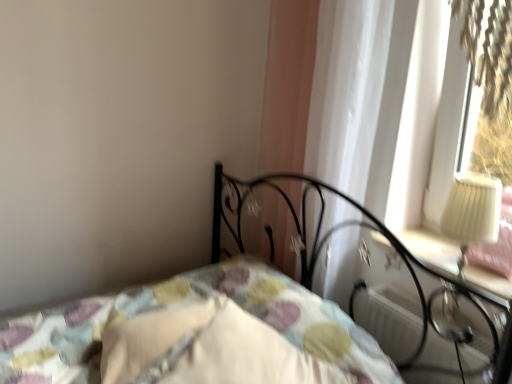
What do you see at coordinates (347, 91) in the screenshot? Image resolution: width=512 pixels, height=384 pixels. I see `white sheer curtain at upper right` at bounding box center [347, 91].

What is the approximate height of white sheer curtain at upper right?

1.04 meters.

I want to click on white soft pillow at center, marked as the 2th pillow in a left-to-right arrangement, so click(x=210, y=348).

Between white soft pillow at center, the first pillow when ordered from right to left, and white plastic radiator at lower right, which one has larger width?

white soft pillow at center, the first pillow when ordered from right to left.

Based on the photo, from their relative heights in the image, would you say white soft pillow at center, marked as the 2th pillow in a left-to-right arrangement, is taller or shorter than white plastic radiator at lower right?

Clearly, white soft pillow at center, marked as the 2th pillow in a left-to-right arrangement, is taller compared to white plastic radiator at lower right.

Is white soft pillow at center, marked as the 2th pillow in a left-to-right arrangement, spatially inside white plastic radiator at lower right, or outside of it?

white soft pillow at center, marked as the 2th pillow in a left-to-right arrangement, cannot be found inside white plastic radiator at lower right.

Between white soft pillow at center, marked as the 2th pillow in a left-to-right arrangement, and white plastic radiator at lower right, which one is positioned in front?

white soft pillow at center, marked as the 2th pillow in a left-to-right arrangement, is in front.

What's the angular difference between white sheer curtain at upper right and patterned fabric bed at center's facing directions?

The angle between the facing direction of white sheer curtain at upper right and the facing direction of patterned fabric bed at center is 1.16 degrees.

From the image's perspective, which is below, white sheer curtain at upper right or patterned fabric bed at center?

patterned fabric bed at center.

Image resolution: width=512 pixels, height=384 pixels. What are the coordinates of `bed in front of the white sheer curtain at upper right` in the screenshot? It's located at pyautogui.click(x=198, y=335).

Based on the photo, is white sheer curtain at upper right positioned behind patterned fabric bed at center?

Yes, the depth of white sheer curtain at upper right is greater than that of patterned fabric bed at center.

From a real-world perspective, between white soft pillow at center, marked as the 2th pillow in a left-to-right arrangement, and white sheer curtain at upper right, who is vertically lower?

white soft pillow at center, marked as the 2th pillow in a left-to-right arrangement.

Consider the image. Does white soft pillow at center, the first pillow when ordered from right to left, appear on the left side of white sheer curtain at upper right?

Indeed, white soft pillow at center, the first pillow when ordered from right to left, is positioned on the left side of white sheer curtain at upper right.

Consider the image. Considering the sizes of white soft pillow at center, marked as the 2th pillow in a left-to-right arrangement, and white sheer curtain at upper right in the image, is white soft pillow at center, marked as the 2th pillow in a left-to-right arrangement, taller or shorter than white sheer curtain at upper right?

Clearly, white soft pillow at center, marked as the 2th pillow in a left-to-right arrangement, is shorter compared to white sheer curtain at upper right.

Is white soft pillow at center, marked as the 2th pillow in a left-to-right arrangement, closer to the viewer compared to white sheer curtain at upper right?

Yes, it is.

I want to click on bed located above the white soft pillow at lower center, the 2th pillow in the right-to-left sequence (from a real-world perspective), so pos(198,335).

From the image's perspective, does patterned fabric bed at center appear higher than white soft pillow at lower center, which is counted as the 1th pillow, starting from the left?

Incorrect, from the image's perspective, patterned fabric bed at center is lower than white soft pillow at lower center, which is counted as the 1th pillow, starting from the left.

In the scene shown: Which object is positioned more to the right, patterned fabric bed at center or white soft pillow at lower center, the 2th pillow in the right-to-left sequence?

Positioned to the right is patterned fabric bed at center.

Locate an element on the screen. This screenshot has height=384, width=512. pillow on the left of white soft pillow at center, marked as the 2th pillow in a left-to-right arrangement is located at coordinates (152, 341).

From a real-world perspective, relative to white soft pillow at lower center, the 2th pillow in the right-to-left sequence, is white soft pillow at center, marked as the 2th pillow in a left-to-right arrangement, vertically above or below?

white soft pillow at center, marked as the 2th pillow in a left-to-right arrangement, is above white soft pillow at lower center, the 2th pillow in the right-to-left sequence.

Considering the sizes of objects white soft pillow at center, the first pillow when ordered from right to left, and white soft pillow at lower center, the 2th pillow in the right-to-left sequence, in the image provided, who is shorter, white soft pillow at center, the first pillow when ordered from right to left, or white soft pillow at lower center, the 2th pillow in the right-to-left sequence,?

Standing shorter between the two is white soft pillow at lower center, the 2th pillow in the right-to-left sequence.

Between white soft pillow at center, the first pillow when ordered from right to left, and white soft pillow at lower center, the 2th pillow in the right-to-left sequence, which one has smaller width?

Thinner between the two is white soft pillow at center, the first pillow when ordered from right to left.

The width and height of the screenshot is (512, 384). Identify the location of the 1st pillow counting from the left side of the white plastic radiator at lower right. (210, 348).

From a real-world perspective, is white plastic radiator at lower right above or below white soft pillow at center, the first pillow when ordered from right to left?

In terms of real-world spatial position, white plastic radiator at lower right is below white soft pillow at center, the first pillow when ordered from right to left.

From the picture: Which is further, (408,373) or (352,379)?

The point (408,373) is more distant.

Is white plastic radiator at lower right oriented away from white soft pillow at center, marked as the 2th pillow in a left-to-right arrangement?

No, white plastic radiator at lower right is not facing away from white soft pillow at center, marked as the 2th pillow in a left-to-right arrangement.

Is white plastic radiator at lower right oriented towards white sheer curtain at upper right?

No, white plastic radiator at lower right is not facing towards white sheer curtain at upper right.

In the scene shown: From the image's perspective, is white plastic radiator at lower right beneath white sheer curtain at upper right?

Correct, white plastic radiator at lower right appears lower than white sheer curtain at upper right in the image.

Is white plastic radiator at lower right taller than white sheer curtain at upper right?

Incorrect, the height of white plastic radiator at lower right is not larger of that of white sheer curtain at upper right.

Is white plastic radiator at lower right inside or outside of white sheer curtain at upper right?

The correct answer is: outside.

At what (x,y) coordinates should I click in order to perform the action: click on pillow that is the 2nd object above the white plastic radiator at lower right (from a real-world perspective). Please return your answer as a coordinate pair (x, y). Image resolution: width=512 pixels, height=384 pixels. Looking at the image, I should click on (210, 348).

Where is `curtain on the right of patterned fabric bed at center`? curtain on the right of patterned fabric bed at center is located at coordinates (347, 91).

Which object lies further to the anchor point white soft pillow at lower center, which is counted as the 1th pillow, starting from the left, white soft pillow at center, marked as the 2th pillow in a left-to-right arrangement, or white sheer curtain at upper right?

The object further to white soft pillow at lower center, which is counted as the 1th pillow, starting from the left, is white sheer curtain at upper right.

From the image, which object appears to be farther from white soft pillow at center, marked as the 2th pillow in a left-to-right arrangement, white soft pillow at lower center, which is counted as the 1th pillow, starting from the left, or white plastic radiator at lower right?

white plastic radiator at lower right.

Estimate the real-world distances between objects in this image. Which object is closer to white plastic radiator at lower right, white sheer curtain at upper right or white soft pillow at lower center, which is counted as the 1th pillow, starting from the left?

white sheer curtain at upper right.

Looking at this image, considering their positions, is white soft pillow at center, marked as the 2th pillow in a left-to-right arrangement, positioned further to white sheer curtain at upper right than white plastic radiator at lower right?

white soft pillow at center, marked as the 2th pillow in a left-to-right arrangement, lies further to white sheer curtain at upper right than the other object.

Which object lies further to the anchor point white soft pillow at lower center, which is counted as the 1th pillow, starting from the left, white plastic radiator at lower right or white soft pillow at center, marked as the 2th pillow in a left-to-right arrangement?

Based on the image, white plastic radiator at lower right appears to be further to white soft pillow at lower center, which is counted as the 1th pillow, starting from the left.

Estimate the real-world distances between objects in this image. Which object is further from white plastic radiator at lower right, white sheer curtain at upper right or white soft pillow at center, marked as the 2th pillow in a left-to-right arrangement?

white soft pillow at center, marked as the 2th pillow in a left-to-right arrangement, is further to white plastic radiator at lower right.

Considering their positions, is white sheer curtain at upper right positioned closer to patterned fabric bed at center than white plastic radiator at lower right?

white plastic radiator at lower right is closer to patterned fabric bed at center.

Which object lies nearer to the anchor point white plastic radiator at lower right, patterned fabric bed at center or white sheer curtain at upper right?

patterned fabric bed at center lies closer to white plastic radiator at lower right than the other object.

Find the location of a particular element. The width and height of the screenshot is (512, 384). pillow between white sheer curtain at upper right and white soft pillow at center, marked as the 2th pillow in a left-to-right arrangement, vertically is located at coordinates (152, 341).

Find the location of `curtain between white soft pillow at lower center, the 2th pillow in the right-to-left sequence, and white plastic radiator at lower right from left to right`. curtain between white soft pillow at lower center, the 2th pillow in the right-to-left sequence, and white plastic radiator at lower right from left to right is located at coordinates (347, 91).

You are a GUI agent. You are given a task and a screenshot of the screen. Output one action in this format:
    pyautogui.click(x=<x>, y=<y>)
    Task: Click on the radiator between patterned fabric bed at center and white sheer curtain at upper right along the z-axis
    This screenshot has width=512, height=384.
    Given the screenshot: What is the action you would take?
    pyautogui.click(x=387, y=318)

This screenshot has width=512, height=384. Identify the location of pillow located between white soft pillow at lower center, the 2th pillow in the right-to-left sequence, and white plastic radiator at lower right in the left-right direction. (210, 348).